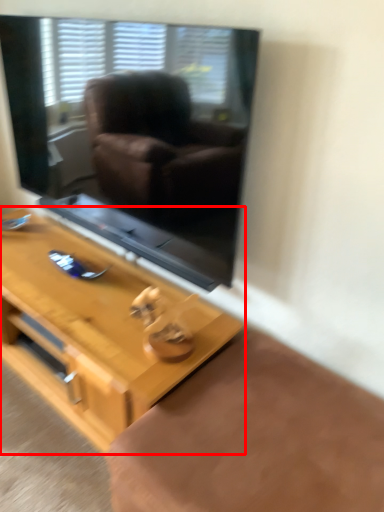
Question: From the image's perspective, where is table (annotated by the red box) located in relation to window screen in the image?

Choices:
 (A) above
 (B) below

Answer: (B)